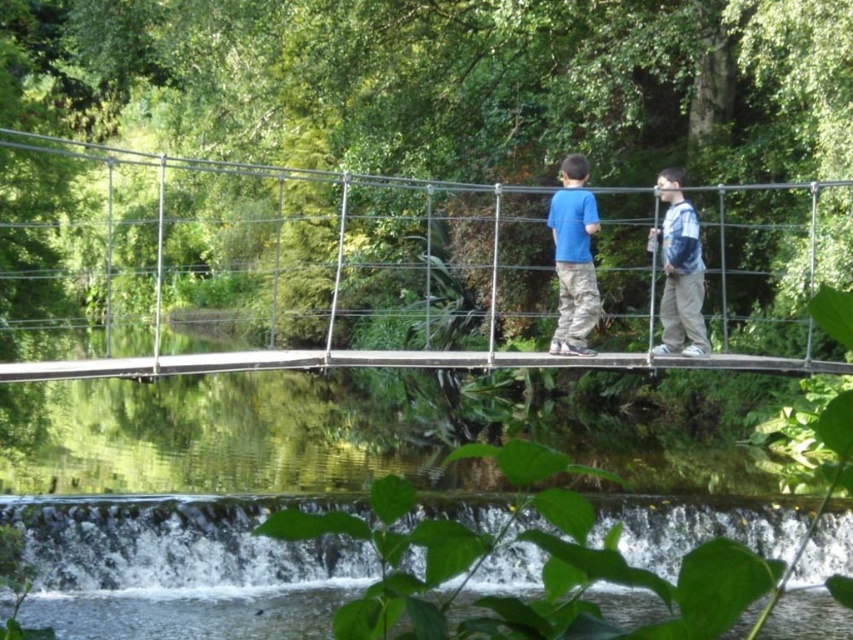
Question: Can you confirm if metallic wire suspension bridge at center is positioned below matte blue shirt at center?

Choices:
 (A) yes
 (B) no

Answer: (B)

Question: Which point appears closest to the camera in this image?

Choices:
 (A) (596, 291)
 (B) (193, 273)

Answer: (A)

Question: Estimate the real-world distances between objects in this image. Which object is closer to the blue denim jacket at right?

Choices:
 (A) matte blue shirt at center
 (B) metallic wire suspension bridge at center

Answer: (A)

Question: Which of the following is the farthest from the observer?

Choices:
 (A) (695, 278)
 (B) (743, 355)
 (C) (566, 198)

Answer: (B)

Question: Can you confirm if metallic wire suspension bridge at center is thinner than blue denim jacket at right?

Choices:
 (A) yes
 (B) no

Answer: (B)

Question: Is matte blue shirt at center further to camera compared to blue denim jacket at right?

Choices:
 (A) no
 (B) yes

Answer: (A)